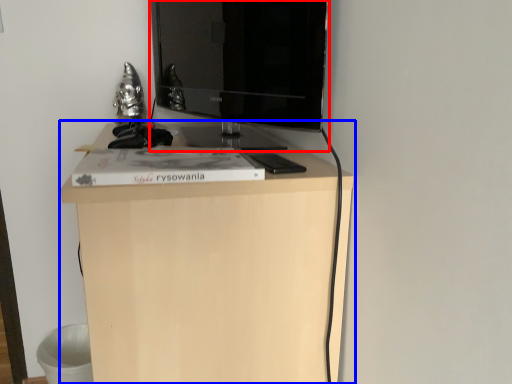
Question: Which object appears farthest to the camera in this image, television (highlighted by a red box) or furniture (highlighted by a blue box)?

Choices:
 (A) television
 (B) furniture

Answer: (A)